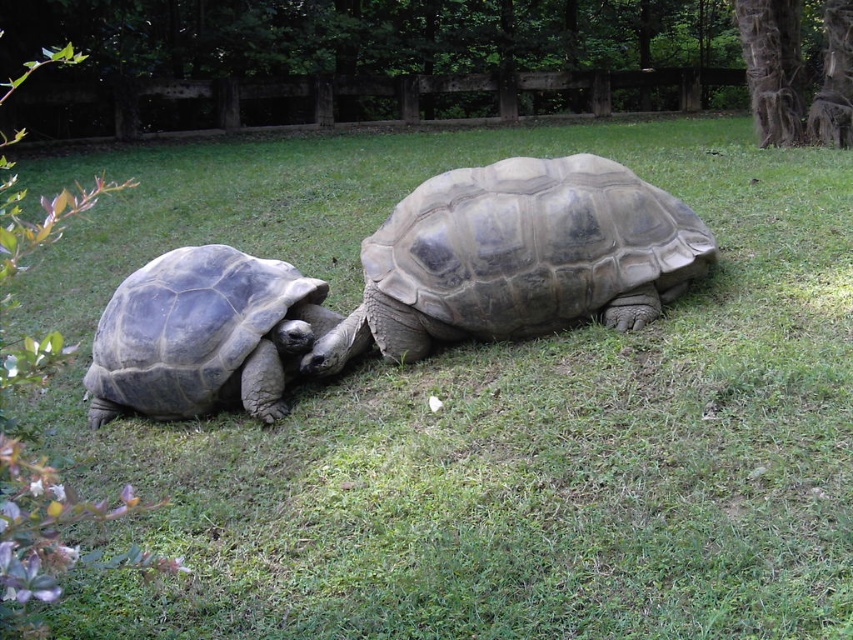
You are a zookeeper who needs to place a feeding tray between the gray textured tortoise at center and the gray matte tortoise at left. The tray requires at least 1 meter of space. Can you fit it between them?

The gray textured tortoise at center is wider than the gray matte tortoise at left, but the exact distance between them isn not specified. Without knowing the actual spacing, it is impossible to determine if the 1 meter requirement is met. Consult the enclosure layout for accurate measurements.

You are a zookeeper who needs to place a feeding tray between the gray textured tortoise at center and the gray matte tortoise at left. The tray requires a minimum of 2 feet of space to be placed safely. Can you determine if there is enough space between them?

The gray textured tortoise at center is bigger than the gray matte tortoise at left, but the description does not provide information about the distance between them. Therefore, it is impossible to determine if there is enough space for the feeding tray.

You are a zookeeper observing two tortoises in their enclosure. You notice two specific points marked in the image. The first point is at coordinates point (514, 276) and the second is at point (152, 369). Based on their positions, which tortoise is closer to the front of the enclosure?

Point (152, 369) is closer to the front of the enclosure because it is positioned in front of point (514, 276).